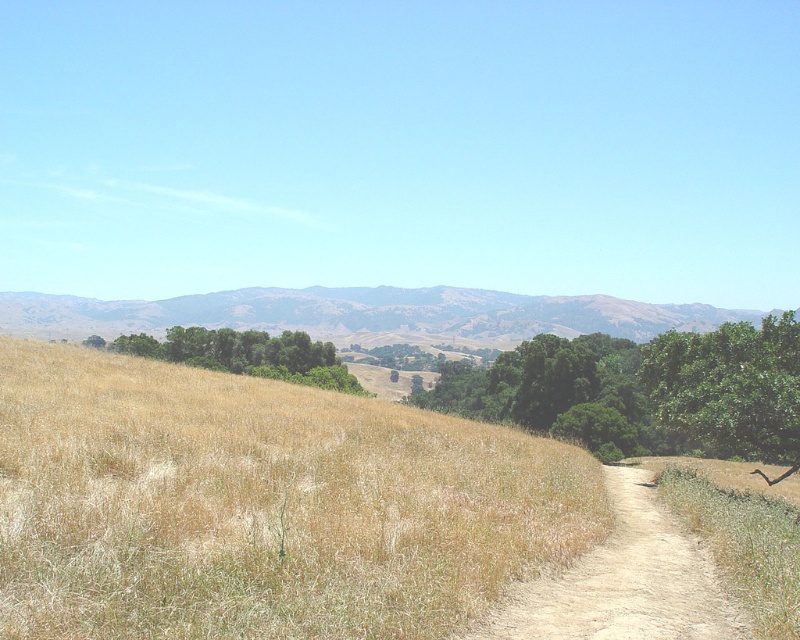
Is dry grass at center to the right of dusty sand path at center from the viewer's perspective?

No, dry grass at center is not to the right of dusty sand path at center.

Between dry grass at center and dusty sand path at center, which one has more height?

dry grass at center

The width and height of the screenshot is (800, 640). Find the location of `dry grass at center`. dry grass at center is located at coordinates (262, 504).

Is point (536, 419) positioned before point (482, 636)?

No, it is behind (482, 636).

Who is higher up, green leafy tree at center-right or dusty sand path at center?

Positioned higher is dusty sand path at center.

Is point (614, 436) positioned behind point (482, 621)?

Yes, it is behind point (482, 621).

Locate an element on the screen. The height and width of the screenshot is (640, 800). green leafy tree at center-right is located at coordinates (644, 390).

Looking at this image, can you confirm if dry grass at center is bigger than green leafy trees at center?

Incorrect, dry grass at center is not larger than green leafy trees at center.

Between dry grass at center and green leafy trees at center, which one has more height?

green leafy trees at center is taller.

Is point (578, 548) farther from camera compared to point (242, 337)?

No, it is not.

I want to click on dry grass at center, so click(x=262, y=504).